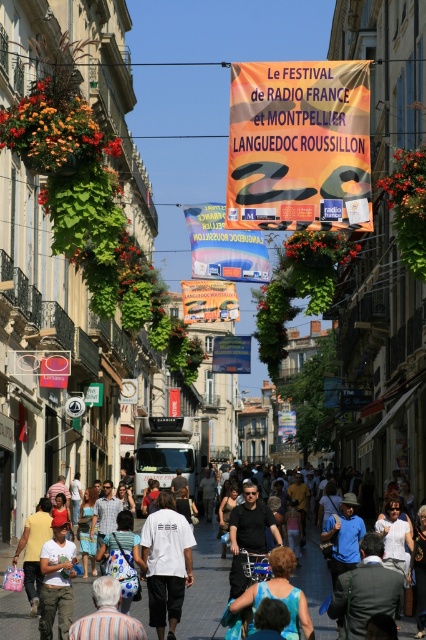
Question: Based on their relative distances, which object is farther from the striped fabric at lower left?

Choices:
 (A) smooth concrete pavement at center
 (B) blue fabric wheelchair at center

Answer: (A)

Question: Considering the real-world distances, which object is farthest from the striped fabric at lower left?

Choices:
 (A) smooth concrete pavement at center
 (B) blue fabric wheelchair at center
 (C) orange fabric banner at center
 (D) white cotton t-shirt at center

Answer: (C)

Question: Estimate the real-world distances between objects in this image. Which object is farther from the white matte t-shirt at center?

Choices:
 (A) smooth concrete pavement at center
 (B) white cotton t-shirt at center
 (C) striped fabric at lower left
 (D) blue fabric wheelchair at center

Answer: (A)

Question: Can you confirm if white cotton t-shirt at center is wider than blue fabric wheelchair at center?

Choices:
 (A) yes
 (B) no

Answer: (B)

Question: Does orange fabric banner at center appear on the left side of white matte t-shirt at center?

Choices:
 (A) yes
 (B) no

Answer: (B)

Question: Can you confirm if orange fabric banner at center is smaller than white matte t-shirt at center?

Choices:
 (A) yes
 (B) no

Answer: (B)